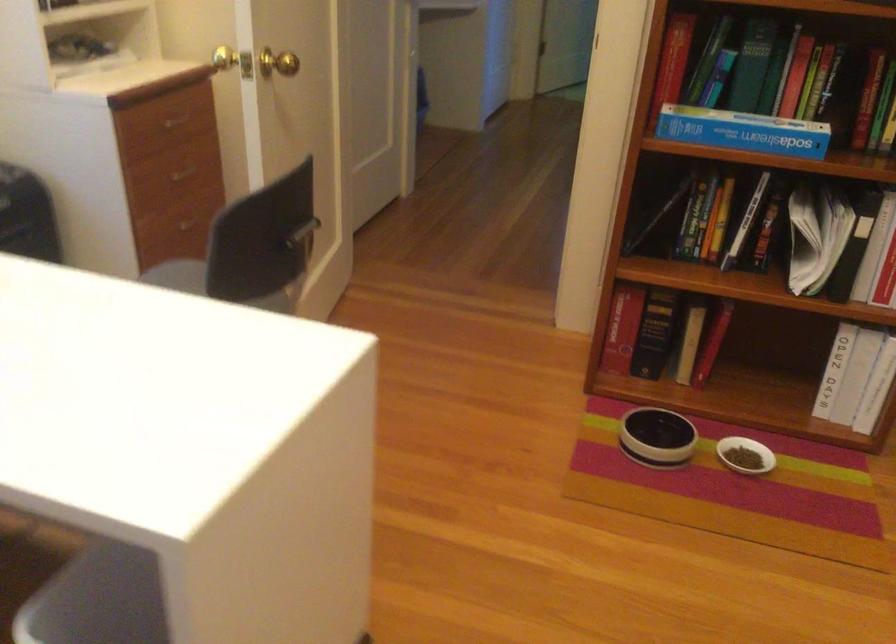
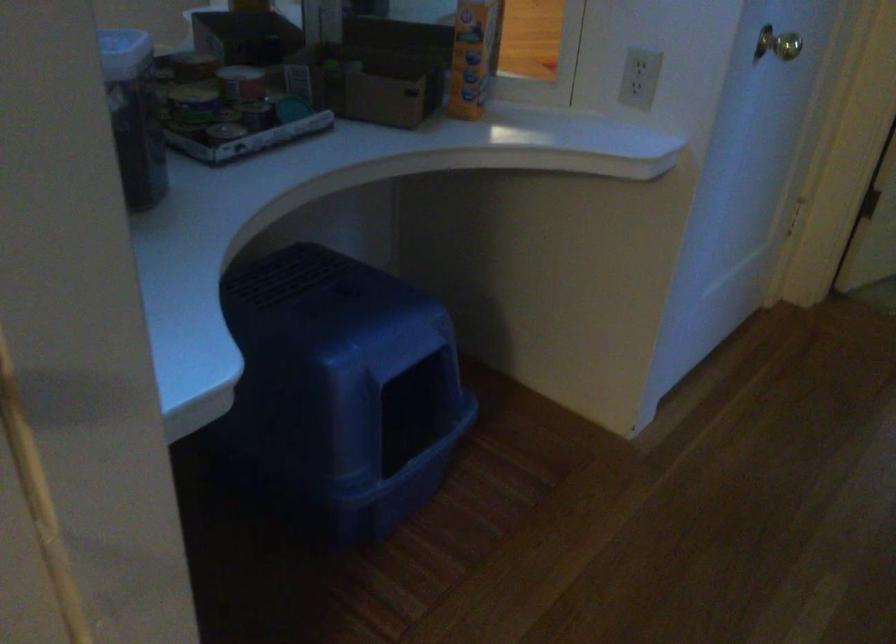
Question: Which direction would the cameraman need to move to produce the second image? Reply with the corresponding letter.

Choices:
 (A) Left
 (B) Right
 (C) Forward
 (D) Backward

Answer: (C)